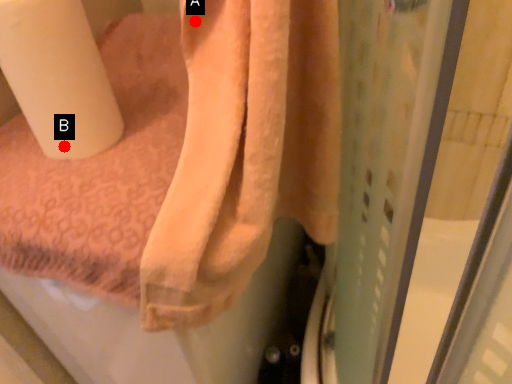
Question: Two points are circled on the image, labeled by A and B beside each circle. Which point is farther to the camera?

Choices:
 (A) A is further
 (B) B is further

Answer: (B)